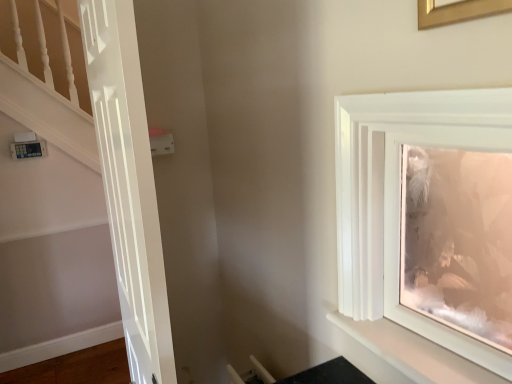
Question: Is white glossy shelf at upper right facing towards gold metallic picture frame at upper right, which is the first picture frame from front to back?

Choices:
 (A) no
 (B) yes

Answer: (A)

Question: Is white glossy shelf at upper right further to camera compared to gold metallic picture frame at upper right, which is the 1th picture frame from top to bottom?

Choices:
 (A) no
 (B) yes

Answer: (B)

Question: From a real-world perspective, is white glossy shelf at upper right physically below gold metallic picture frame at upper right, arranged as the 2th picture frame when viewed from the back?

Choices:
 (A) no
 (B) yes

Answer: (B)

Question: Does white glossy shelf at upper right have a greater width compared to gold metallic picture frame at upper right, arranged as the 2th picture frame when viewed from the back?

Choices:
 (A) yes
 (B) no

Answer: (A)

Question: Is gold metallic picture frame at upper right, arranged as the 2th picture frame when viewed from the back, located within white glossy shelf at upper right?

Choices:
 (A) yes
 (B) no

Answer: (B)

Question: Can you confirm if white glossy shelf at upper right is shorter than gold metallic picture frame at upper right, arranged as the 2th picture frame when viewed from the back?

Choices:
 (A) no
 (B) yes

Answer: (B)

Question: Does white plastic light switch at upper center have a greater width compared to gold metallic picture frame at upper right, which is the 1th picture frame from top to bottom?

Choices:
 (A) yes
 (B) no

Answer: (A)

Question: Is white plastic light switch at upper center thinner than gold metallic picture frame at upper right, which is the first picture frame from front to back?

Choices:
 (A) no
 (B) yes

Answer: (A)

Question: Is gold metallic picture frame at upper right, which is the first picture frame from front to back, surrounded by white plastic light switch at upper center?

Choices:
 (A) yes
 (B) no

Answer: (B)

Question: Is white plastic light switch at upper center further to camera compared to gold metallic picture frame at upper right, the 2th picture frame positioned from the bottom?

Choices:
 (A) yes
 (B) no

Answer: (A)

Question: Would you say white plastic light switch at upper center is a long distance from gold metallic picture frame at upper right, which is the 1th picture frame from top to bottom?

Choices:
 (A) yes
 (B) no

Answer: (A)

Question: From a real-world perspective, does white plastic light switch at upper center sit lower than gold metallic picture frame at upper right, which is the first picture frame from front to back?

Choices:
 (A) no
 (B) yes

Answer: (B)

Question: Does white glossy shelf at upper right come behind white plastic light switch at upper center?

Choices:
 (A) no
 (B) yes

Answer: (A)